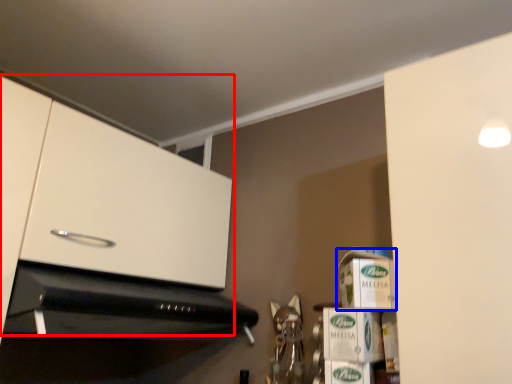
Question: Among these objects, which one is nearest to the camera, cabinetry (highlighted by a red box) or cardboard box (highlighted by a blue box)?

Choices:
 (A) cabinetry
 (B) cardboard box

Answer: (A)